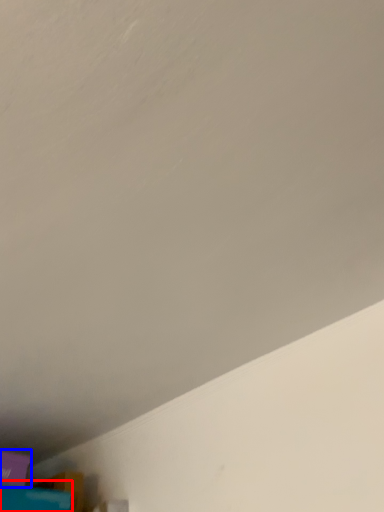
Question: Which object appears farthest to the camera in this image, wide (highlighted by a red box) or box (highlighted by a blue box)?

Choices:
 (A) wide
 (B) box

Answer: (B)